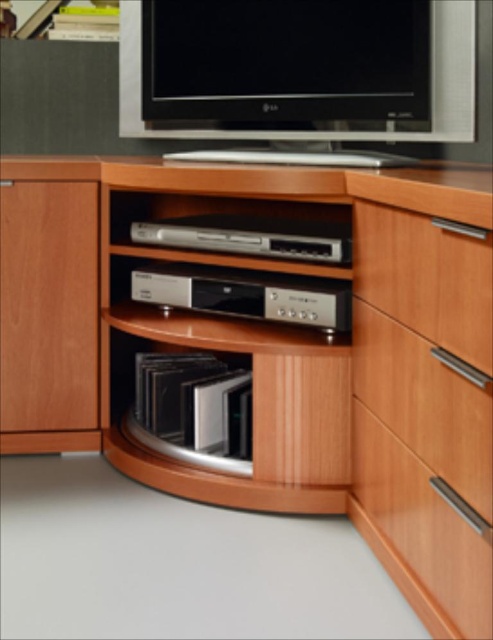
You are organizing a movie night and need to access both the wooden drawer at right and the black glossy cd case at center. Based on their positions, which one would you need to reach over first to get to the other?

The wooden drawer at right is above the black glossy cd case at center, so you would need to reach over the wooden drawer at right first to access the black glossy cd case at center.

You are organizing DVDs in the entertainment unit. You have a wooden drawer at right and a black glossy cd case at center. Which one is more to the right?

The wooden drawer at right is more to the right than the black glossy cd case at center.